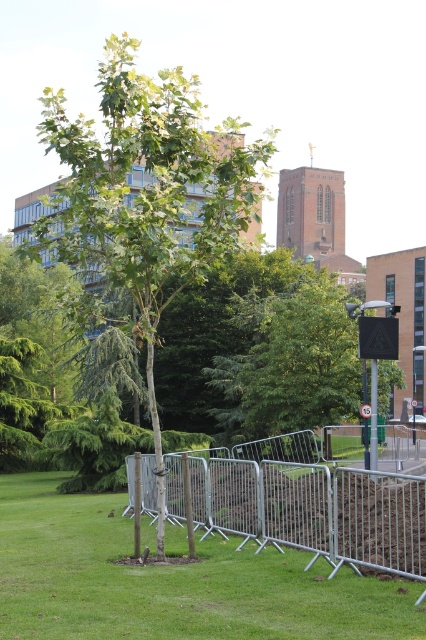
Question: Which object appears farthest from the camera in this image?

Choices:
 (A) green grass at center
 (B) green leafy tree at center

Answer: (B)

Question: Where is green leafy tree at center located in relation to silver/galvanized metal fence at center in the image?

Choices:
 (A) below
 (B) above

Answer: (B)

Question: Which point is farther from the camera taking this photo?

Choices:
 (A) (374, 394)
 (B) (114, 154)

Answer: (A)

Question: Can you confirm if green leafy tree at center is wider than silver/galvanized metal fence at center?

Choices:
 (A) yes
 (B) no

Answer: (A)

Question: Which object is the closest to the green leafy tree at center?

Choices:
 (A) green grass at center
 (B) metallic pole at right
 (C) silver/galvanized metal fence at center

Answer: (C)

Question: Can you confirm if green grass at center is positioned below metallic pole at right?

Choices:
 (A) no
 (B) yes

Answer: (B)